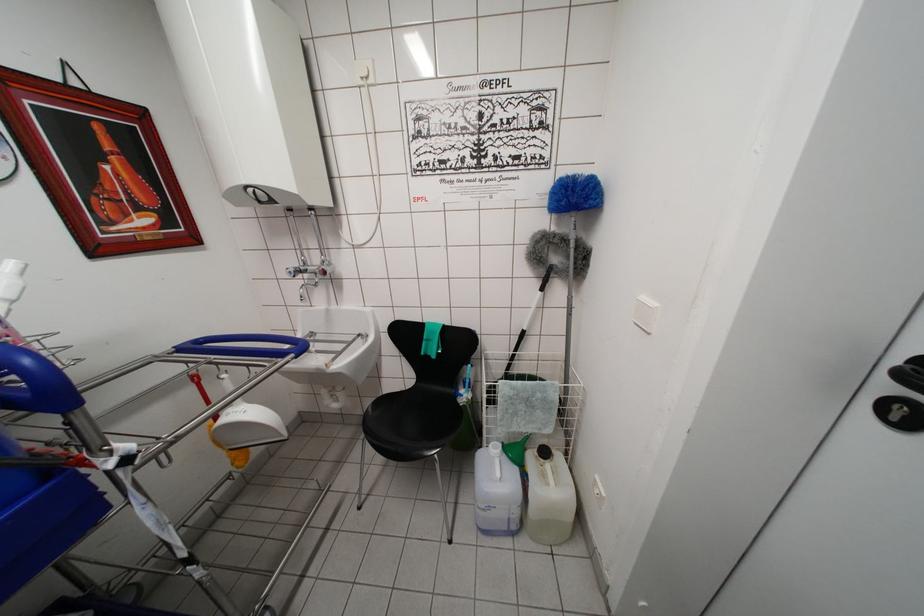
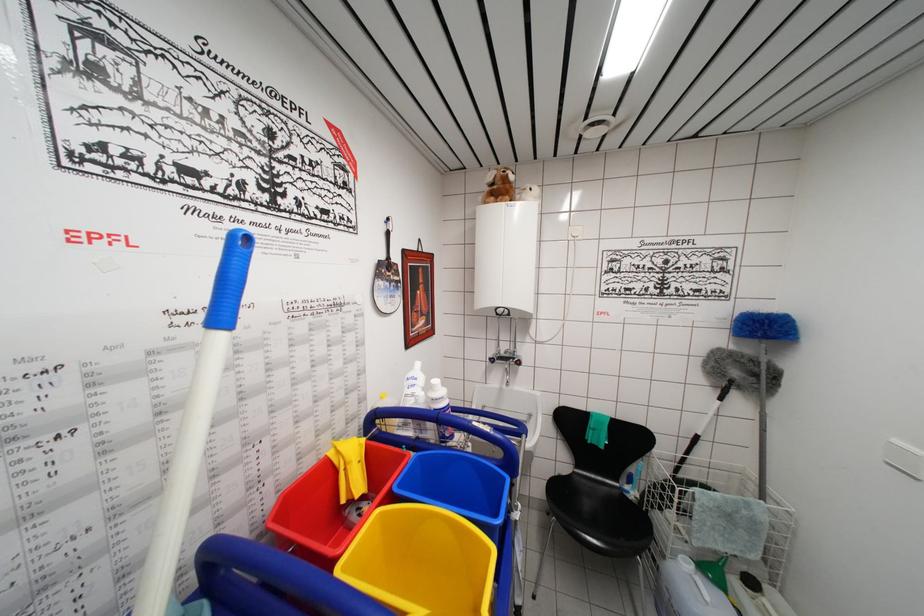
Question: Based on the continuous images, in which direction is the camera rotating? Reply with the corresponding letter.

Choices:
 (A) Left
 (B) Right
 (C) Up
 (D) Down

Answer: (C)